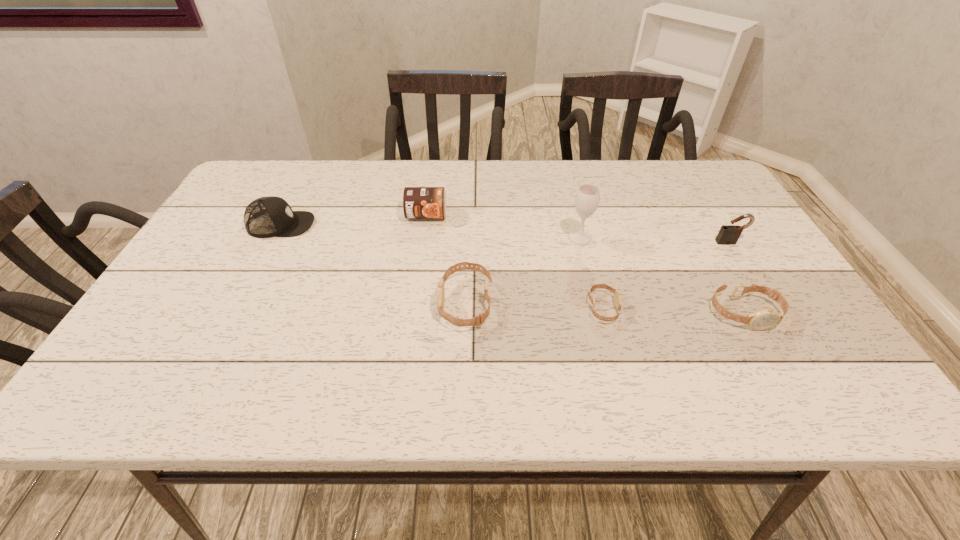
Find the location of a particular element. Image resolution: width=960 pixels, height=540 pixels. free space between the leftmost watch and the padlock is located at coordinates (597, 273).

The height and width of the screenshot is (540, 960). What are the coordinates of `blank region between the can and the rightmost watch` in the screenshot? It's located at (586, 264).

You are a GUI agent. You are given a task and a screenshot of the screen. Output one action in this format:
    pyautogui.click(x=<x>, y=<y>)
    Task: Click on the vacant region between the rightmost watch and the leftmost watch
    The width and height of the screenshot is (960, 540).
    Given the screenshot: What is the action you would take?
    pyautogui.click(x=605, y=308)

In order to click on vacant space that is in between the padlock and the sixth object from right to left in this screenshot , I will do `click(578, 229)`.

The width and height of the screenshot is (960, 540). Identify the location of free space between the third object from left to right and the wineglass. (522, 271).

This screenshot has width=960, height=540. I want to click on blank region between the padlock and the second shortest object, so click(737, 278).

Find the location of `blank region between the tallest object and the third object from left to right`. blank region between the tallest object and the third object from left to right is located at coordinates (522, 271).

Where is `object that is the second closest one to the padlock`? This screenshot has width=960, height=540. object that is the second closest one to the padlock is located at coordinates (587, 198).

What are the coordinates of `the second closest object to the cap` in the screenshot? It's located at (479, 319).

Identify which watch is the second closest to the cap. Please provide its 2D coordinates. Your answer should be formatted as a tuple, i.e. [(x, y)], where the tuple contains the x and y coordinates of a point satisfying the conditions above.

[(617, 294)]